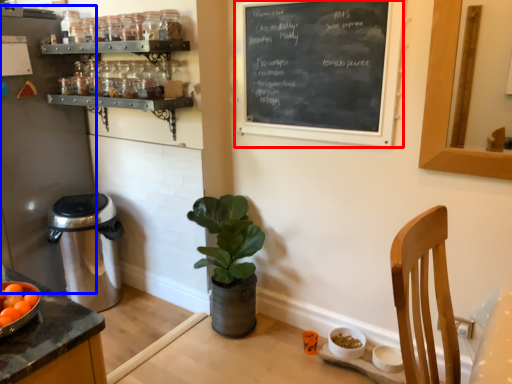
Question: Which of the following is the closest to the observer, bulletin board (highlighted by a red box) or appliance (highlighted by a blue box)?

Choices:
 (A) bulletin board
 (B) appliance

Answer: (A)